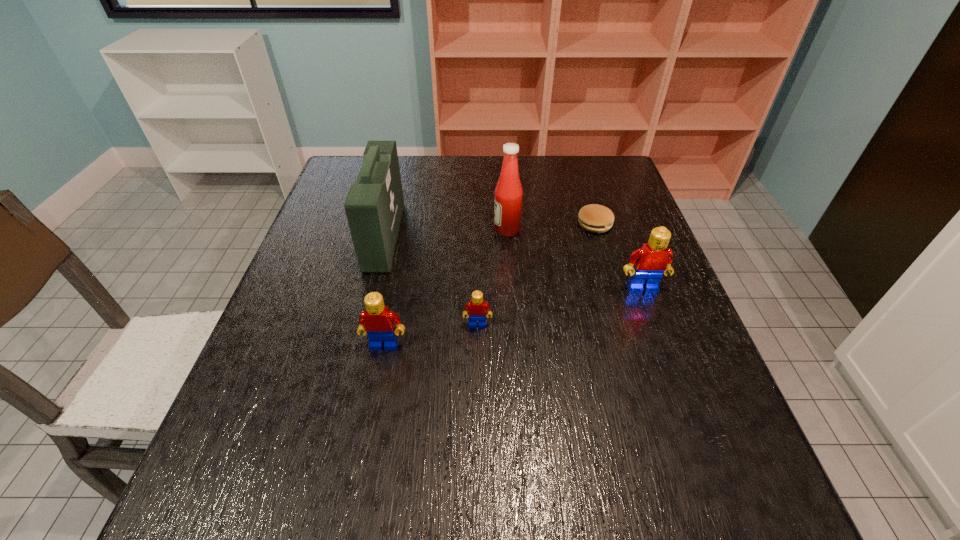
Image resolution: width=960 pixels, height=540 pixels. I want to click on vacant area at the near edge, so click(556, 422).

Locate an element on the screen. This screenshot has height=540, width=960. vacant area at the right edge is located at coordinates (708, 386).

This screenshot has width=960, height=540. In the image, there is a desktop. Identify the location of vacant region at the near left corner. (226, 440).

Identify the location of vacant area between the patty and the fourth object from right to left. This screenshot has height=540, width=960. (536, 274).

In order to click on vacant area that lies between the first-aid kit and the fourth tallest object in this screenshot , I will do `click(385, 291)`.

What are the coordinates of `vacant space that is in between the fourth object from left to right and the nearest object` in the screenshot? It's located at (445, 288).

This screenshot has width=960, height=540. Find the location of `free spot between the shortest Lego and the third object from right to left`. free spot between the shortest Lego and the third object from right to left is located at coordinates (492, 278).

Locate an element on the screen. This screenshot has width=960, height=540. unoccupied position between the third nearest object and the first-aid kit is located at coordinates (514, 262).

I want to click on unoccupied area between the condiment and the nearest Lego, so click(445, 288).

Locate an element on the screen. vacant point located between the third nearest object and the leftmost Lego is located at coordinates (514, 316).